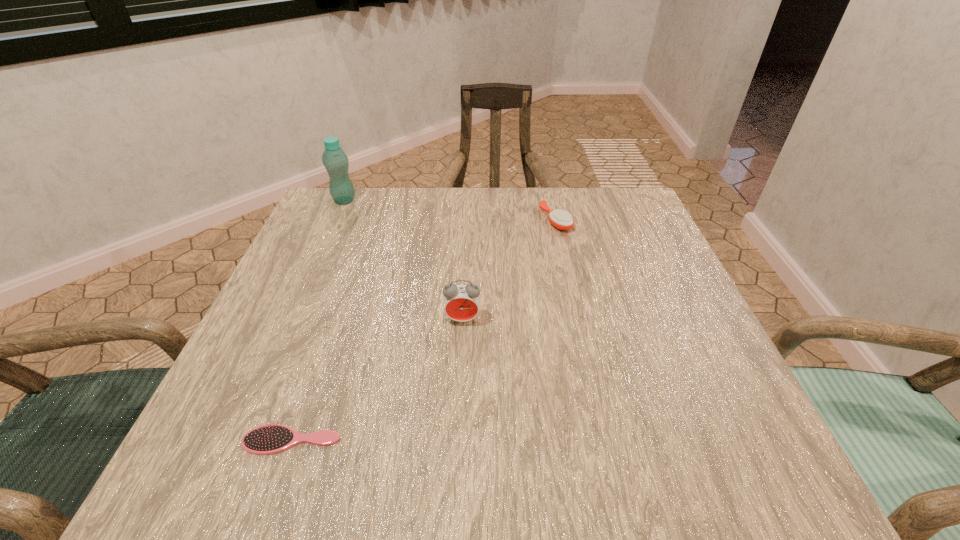
What are the coordinates of `free spot between the rightmost object and the shorter hairbrush` in the screenshot? It's located at (423, 330).

Identify the location of vacant area between the water bottle and the third shortest object. This screenshot has height=540, width=960. (403, 260).

At what (x,y) coordinates should I click in order to perform the action: click on vacant area between the shortest object and the third nearest object. Please return your answer as a coordinate pair (x, y). This screenshot has height=540, width=960. Looking at the image, I should click on (423, 330).

You are a GUI agent. You are given a task and a screenshot of the screen. Output one action in this format:
    pyautogui.click(x=<x>, y=<y>)
    Task: Click on the free space between the farthest object and the second tallest object
    Image resolution: width=960 pixels, height=540 pixels.
    Given the screenshot: What is the action you would take?
    pyautogui.click(x=403, y=260)

Locate an element on the screen. object that is the second closest to the shorter hairbrush is located at coordinates (560, 219).

Select which object appears as the second closest to the farther hairbrush. Please provide its 2D coordinates. Your answer should be formatted as a tuple, i.e. [(x, y)], where the tuple contains the x and y coordinates of a point satisfying the conditions above.

[(334, 159)]

Find the location of a particular element. This screenshot has width=960, height=540. blank area in the image that satisfies the following two spatial constraints: 1. at the front cap of the tallest object; 2. on the right side of the shorter hairbrush is located at coordinates (239, 440).

Locate an element on the screen. vacant region that satisfies the following two spatial constraints: 1. at the front cap of the left hairbrush; 2. on the right side of the tallest object is located at coordinates (239, 440).

The width and height of the screenshot is (960, 540). In order to click on free space in the image that satisfies the following two spatial constraints: 1. on the back side of the left hairbrush; 2. at the front cap of the farthest object in this screenshot , I will do `click(374, 200)`.

I want to click on free space that satisfies the following two spatial constraints: 1. at the front cap of the water bottle; 2. on the back side of the nearer hairbrush, so click(239, 440).